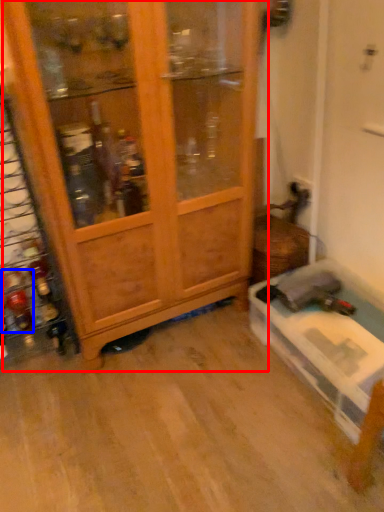
Question: Among these objects, which one is farthest to the camera, cupboard (highlighted by a red box) or bottle (highlighted by a blue box)?

Choices:
 (A) cupboard
 (B) bottle

Answer: (B)